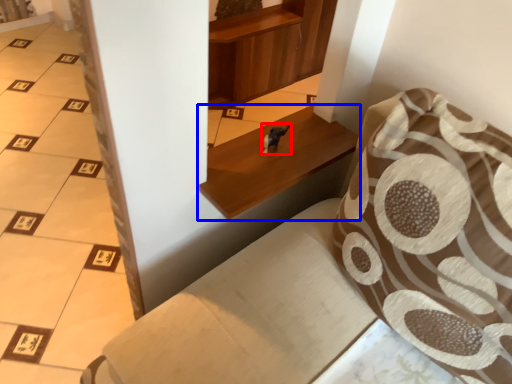
Question: Which object appears farthest to the camera in this image, animal (highlighted by a red box) or furniture (highlighted by a blue box)?

Choices:
 (A) animal
 (B) furniture

Answer: (A)